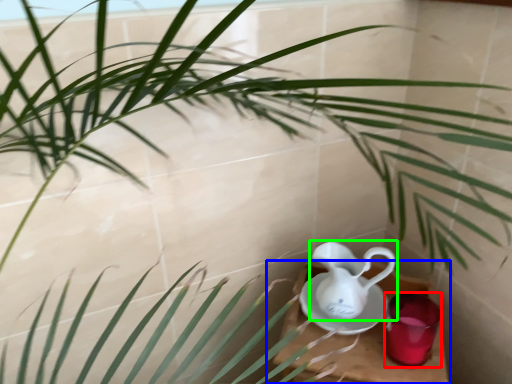
Question: Which object is the closest to the tableware (highlighted by a red box)? Choose among these: table (highlighted by a blue box) or jug (highlighted by a green box).

Choices:
 (A) table
 (B) jug

Answer: (A)